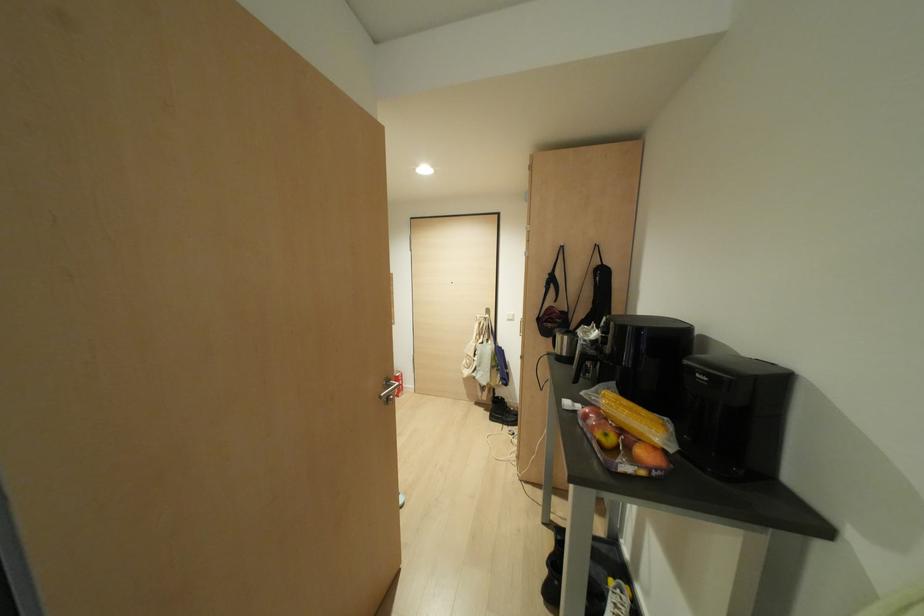
Describe the element at coordinates (585, 368) in the screenshot. This screenshot has width=924, height=616. I see `the kettle handle` at that location.